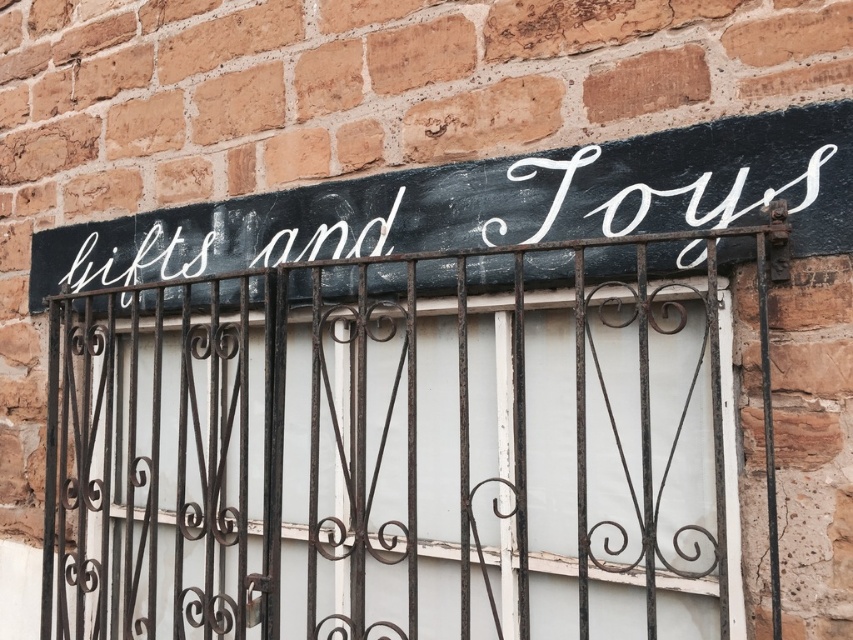
Is point (299, 234) closer to viewer compared to point (567, 184)?

That is False.

Which of these two, white painted wood sign at upper center or white painted sign at upper center, stands taller?

With more height is white painted wood sign at upper center.

Image resolution: width=853 pixels, height=640 pixels. I want to click on white painted wood sign at upper center, so click(x=490, y=204).

Find the location of `rusty metal bars at center`. rusty metal bars at center is located at coordinates click(386, 461).

You are a GUI agent. You are given a task and a screenshot of the screen. Output one action in this format:
    pyautogui.click(x=<x>, y=<y>)
    Task: Click on the rusty metal bars at center
    
    Given the screenshot: What is the action you would take?
    pyautogui.click(x=386, y=461)

Which is below, rusty metal bars at center or white painted sign at upper center?

rusty metal bars at center

Does rusty metal bars at center come in front of white painted sign at upper center?

Yes, it is.

Where is `rusty metal bars at center`? The image size is (853, 640). rusty metal bars at center is located at coordinates (386, 461).